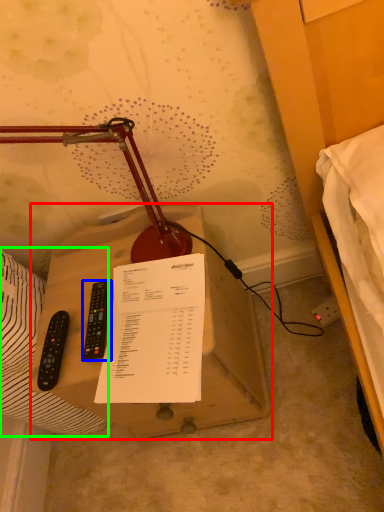
Question: Based on their relative distances, which object is farther from table (highlighted by a red box)? Choose from remote control (highlighted by a blue box) and sheet (highlighted by a green box).

Choices:
 (A) remote control
 (B) sheet

Answer: (A)